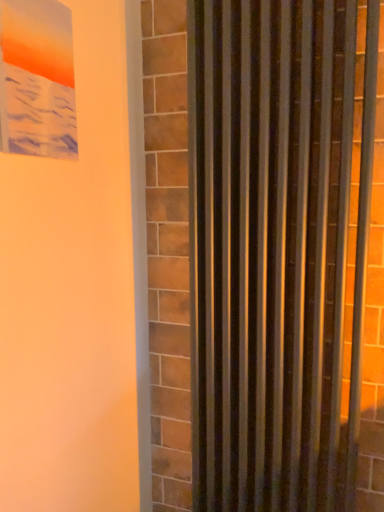
Question: Is metallic silver curtain at right inside the boundaries of matte plastic picture frame at upper left, or outside?

Choices:
 (A) outside
 (B) inside

Answer: (A)

Question: From the image's perspective, is metallic silver curtain at right positioned above or below matte plastic picture frame at upper left?

Choices:
 (A) above
 (B) below

Answer: (B)

Question: Does point (243, 498) appear closer or farther from the camera than point (61, 67)?

Choices:
 (A) closer
 (B) farther

Answer: (B)

Question: Is point (3, 86) positioned closer to the camera than point (196, 156)?

Choices:
 (A) farther
 (B) closer

Answer: (B)

Question: Considering the positions of matte plastic picture frame at upper left and metallic silver curtain at right in the image, is matte plastic picture frame at upper left wider or thinner than metallic silver curtain at right?

Choices:
 (A) wide
 (B) thin

Answer: (B)

Question: Is matte plastic picture frame at upper left in front of or behind metallic silver curtain at right in the image?

Choices:
 (A) front
 (B) behind

Answer: (A)

Question: From a real-world perspective, is matte plastic picture frame at upper left above or below metallic silver curtain at right?

Choices:
 (A) below
 (B) above

Answer: (B)